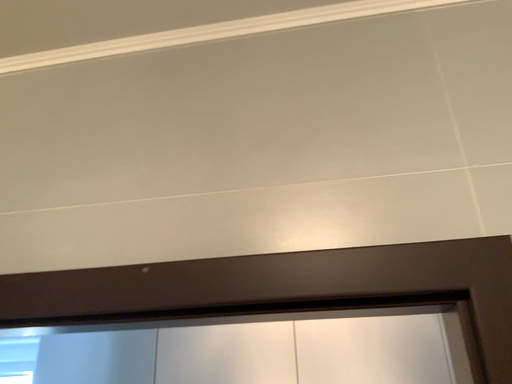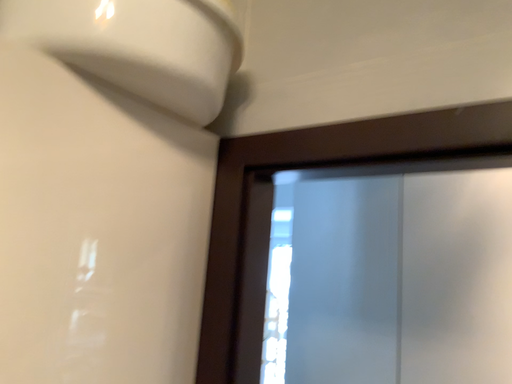
Question: Which way did the camera rotate in the video?

Choices:
 (A) rotated right
 (B) rotated left

Answer: (B)